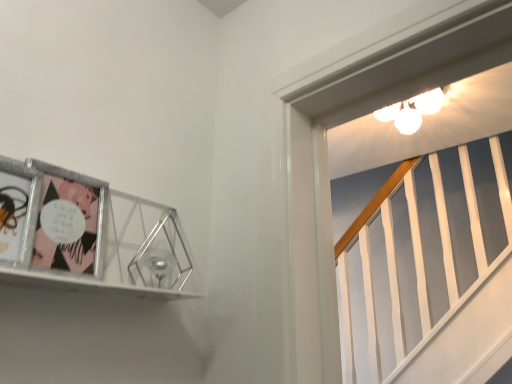
Question: Does metallic silver picture frame at upper left lie behind matte black comic book at left, the second comic book in the back-to-front sequence?

Choices:
 (A) yes
 (B) no

Answer: (B)

Question: Is metallic silver picture frame at upper left shorter than matte black comic book at left, the second comic book in the back-to-front sequence?

Choices:
 (A) no
 (B) yes

Answer: (A)

Question: Could you tell me if metallic silver picture frame at upper left is turned towards matte black comic book at left, the second comic book in the back-to-front sequence?

Choices:
 (A) yes
 (B) no

Answer: (A)

Question: Is metallic silver picture frame at upper left at the left side of matte black comic book at left, the second comic book in the back-to-front sequence?

Choices:
 (A) yes
 (B) no

Answer: (B)

Question: From the image's perspective, is metallic silver picture frame at upper left above matte black comic book at left, the first comic book when ordered from front to back?

Choices:
 (A) no
 (B) yes

Answer: (A)

Question: In terms of width, does matte plastic comic book at left, the first comic book positioned from the back, look wider or thinner when compared to metallic silver picture frame at upper left?

Choices:
 (A) wide
 (B) thin

Answer: (B)

Question: Relative to metallic silver picture frame at upper left, is matte plastic comic book at left, the first comic book positioned from the back, in front or behind?

Choices:
 (A) front
 (B) behind

Answer: (B)

Question: From a real-world perspective, is matte plastic comic book at left, the first comic book positioned from the back, above or below metallic silver picture frame at upper left?

Choices:
 (A) above
 (B) below

Answer: (A)

Question: Would you say matte plastic comic book at left, marked as the 2th comic book in a front-to-back arrangement, is inside or outside metallic silver picture frame at upper left?

Choices:
 (A) outside
 (B) inside

Answer: (B)

Question: From a real-world perspective, is matte black comic book at left, the first comic book when ordered from front to back, positioned above or below metallic silver picture frame at upper left?

Choices:
 (A) above
 (B) below

Answer: (B)

Question: From their relative heights in the image, would you say matte black comic book at left, the second comic book in the back-to-front sequence, is taller or shorter than metallic silver picture frame at upper left?

Choices:
 (A) tall
 (B) short

Answer: (B)

Question: Would you say matte black comic book at left, the second comic book in the back-to-front sequence, is to the left or to the right of metallic silver picture frame at upper left in the picture?

Choices:
 (A) left
 (B) right

Answer: (A)

Question: From the image's perspective, relative to metallic silver picture frame at upper left, is matte black comic book at left, the second comic book in the back-to-front sequence, above or below?

Choices:
 (A) above
 (B) below

Answer: (A)

Question: In the image, is metallic silver picture frame at upper left positioned in front of or behind matte black comic book at left, the first comic book when ordered from front to back?

Choices:
 (A) front
 (B) behind

Answer: (A)

Question: Is metallic silver picture frame at upper left taller or shorter than matte black comic book at left, the first comic book when ordered from front to back?

Choices:
 (A) tall
 (B) short

Answer: (A)